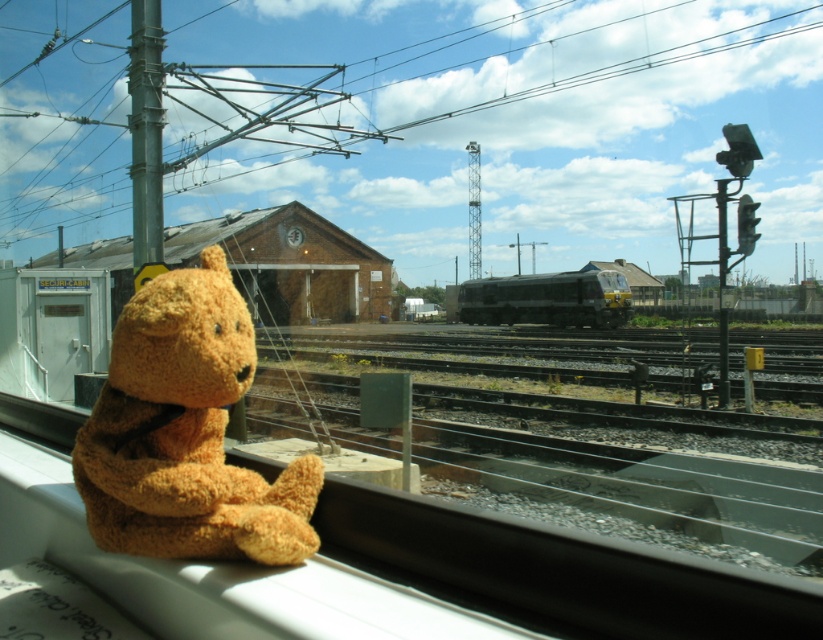
You are inside the train and want to place a small toy on the windowsill so that it aligns with the brick outside. Given the fuzzy brown teddy bear at left is already on the windowsill, where should you place the new toy relative to the teddy bear?

The fuzzy brown teddy bear at left is located at point (x=184, y=433) on the windowsill. To align the new toy with the brick outside, place it to the left of the fuzzy brown teddy bear at left since the brick is positioned to the left of the tracks, which are visible through the window.

You are inside a train and looking out the window. There is a point marked at coordinates (184, 433). What object is located at that point?

The point at (184, 433) indicates the fuzzy brown teddy bear at left.